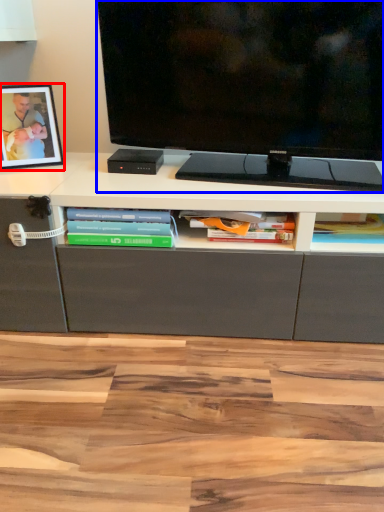
Question: Which object is closer to the camera taking this photo, picture frame (highlighted by a red box) or television (highlighted by a blue box)?

Choices:
 (A) picture frame
 (B) television

Answer: (B)